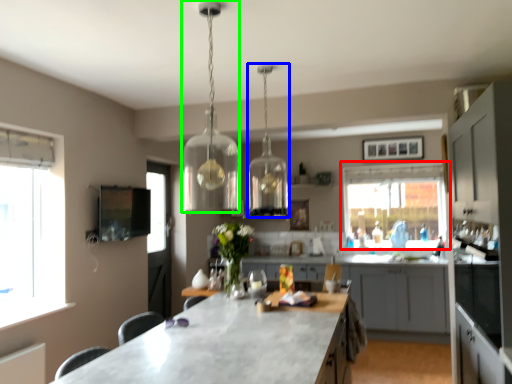
Question: Which object is positioned farthest from window (highlighted by a red box)? Select from lamp (highlighted by a blue box) and lamp (highlighted by a green box).

Choices:
 (A) lamp
 (B) lamp

Answer: (B)